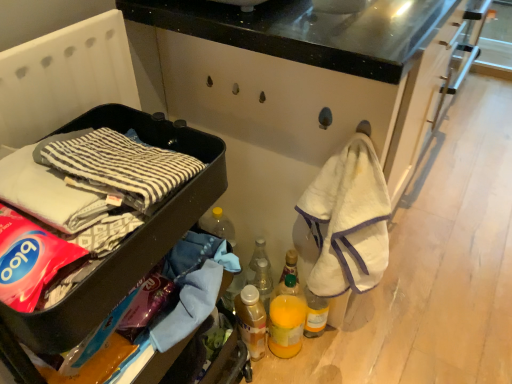
Question: Is black plastic container at left smaller than translucent plastic bottle at lower center, the second bottle positioned from the top?

Choices:
 (A) no
 (B) yes

Answer: (A)

Question: Can you confirm if black plastic container at left is shorter than translucent plastic bottle at lower center, the second bottle positioned from the top?

Choices:
 (A) yes
 (B) no

Answer: (B)

Question: Could translucent plastic bottle at lower center, the first bottle ordered from the bottom, be considered to be inside black plastic container at left?

Choices:
 (A) yes
 (B) no

Answer: (B)

Question: Is the surface of black plastic container at left in direct contact with translucent plastic bottle at lower center, the second bottle positioned from the top?

Choices:
 (A) no
 (B) yes

Answer: (A)

Question: Is black plastic container at left completely or partially outside of translucent plastic bottle at lower center, the second bottle positioned from the top?

Choices:
 (A) yes
 (B) no

Answer: (A)

Question: From the image's perspective, is black plastic container at left on top of translucent plastic bottle at lower center, the first bottle ordered from the bottom?

Choices:
 (A) no
 (B) yes

Answer: (B)

Question: From the image's perspective, does translucent plastic bottle at lower center, the first bottle ordered from the bottom, appear lower than translucent plastic bottle at center, arranged as the 1th bottle when viewed from the top?

Choices:
 (A) no
 (B) yes

Answer: (B)

Question: Is translucent plastic bottle at lower center, the first bottle ordered from the bottom, wider than translucent plastic bottle at center, the second bottle ordered from the bottom?

Choices:
 (A) yes
 (B) no

Answer: (A)

Question: Is translucent plastic bottle at lower center, the first bottle ordered from the bottom, bigger than translucent plastic bottle at center, arranged as the 1th bottle when viewed from the top?

Choices:
 (A) no
 (B) yes

Answer: (B)

Question: Can you confirm if translucent plastic bottle at lower center, the first bottle ordered from the bottom, is smaller than translucent plastic bottle at center, the second bottle ordered from the bottom?

Choices:
 (A) no
 (B) yes

Answer: (A)

Question: Does translucent plastic bottle at lower center, the second bottle positioned from the top, have a greater height compared to translucent plastic bottle at center, arranged as the 1th bottle when viewed from the top?

Choices:
 (A) yes
 (B) no

Answer: (A)

Question: Does translucent plastic bottle at lower center, the second bottle positioned from the top, touch translucent plastic bottle at center, the second bottle ordered from the bottom?

Choices:
 (A) yes
 (B) no

Answer: (A)

Question: From a real-world perspective, is translucent plastic bottle at center, the second bottle ordered from the bottom, under translucent plastic bottle at lower center, the second bottle positioned from the top?

Choices:
 (A) yes
 (B) no

Answer: (B)